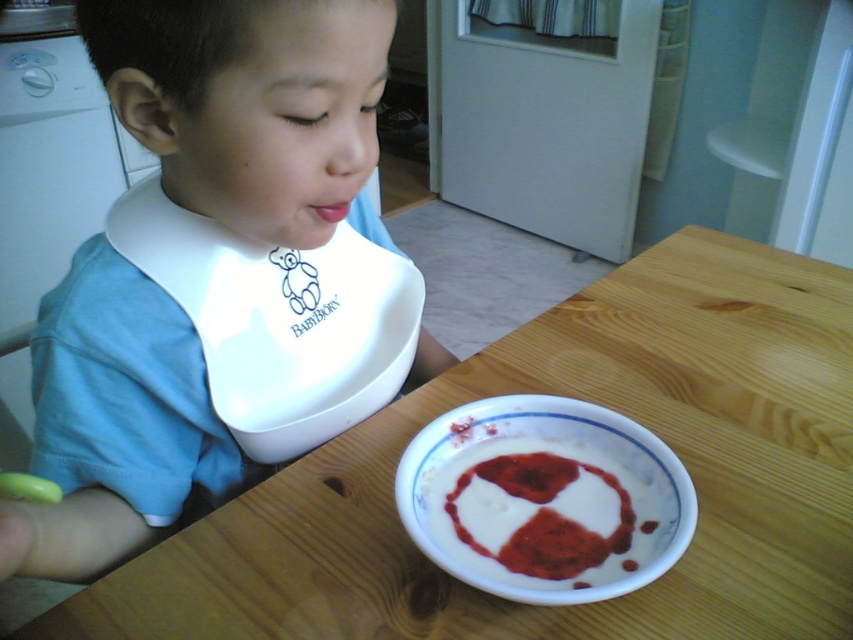
Question: Does blue fabric bib at upper left appear under white glossy bowl at lower center?

Choices:
 (A) no
 (B) yes

Answer: (A)

Question: Can you confirm if white plastic bib at upper left is positioned above pink matte lips at center?

Choices:
 (A) yes
 (B) no

Answer: (B)

Question: Is wooden table at center to the right of white plastic bib at upper left from the viewer's perspective?

Choices:
 (A) yes
 (B) no

Answer: (A)

Question: Which object is the farthest from the white creamy food at lower center?

Choices:
 (A) wooden table at center
 (B) white plastic bib at upper left
 (C) white glossy bowl at lower center

Answer: (A)

Question: Among these objects, which one is farthest from the camera?

Choices:
 (A) wooden table at center
 (B) white plastic bib at upper left

Answer: (B)

Question: Considering the real-world distances, which object is closest to the white glossy bowl at lower center?

Choices:
 (A) blue fabric bib at upper left
 (B) wooden table at center
 (C) pink matte lips at center

Answer: (B)